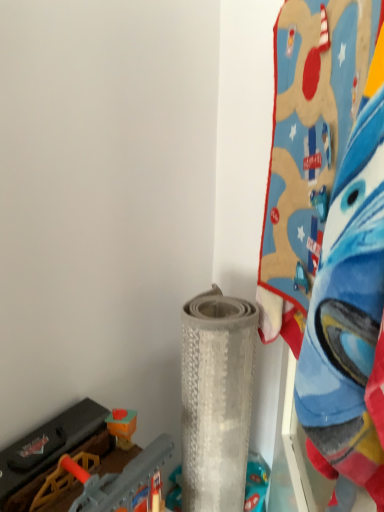
Question: From the image's perspective, is gray textured mat at center, acting as the second toy starting from the right, above or below blue plush blanket at upper right, which is the 1th toy from right to left?

Choices:
 (A) below
 (B) above

Answer: (A)

Question: From a real-world perspective, is gray textured mat at center, the second toy viewed from the left, physically located above or below blue plush blanket at upper right, which is the 1th toy from right to left?

Choices:
 (A) above
 (B) below

Answer: (B)

Question: Considering the real-world distances, which object is closest to the plastic toy train at lower left, positioned as the third toy in right-to-left order?

Choices:
 (A) gray textured mat at center, acting as the second toy starting from the right
 (B) blue plush blanket at upper right, the 3th toy positioned from the left

Answer: (A)

Question: Estimate the real-world distances between objects in this image. Which object is closer to the plastic toy train at lower left, positioned as the third toy in right-to-left order?

Choices:
 (A) gray textured mat at center, acting as the second toy starting from the right
 (B) blue plush blanket at upper right, which is the 1th toy from right to left

Answer: (A)